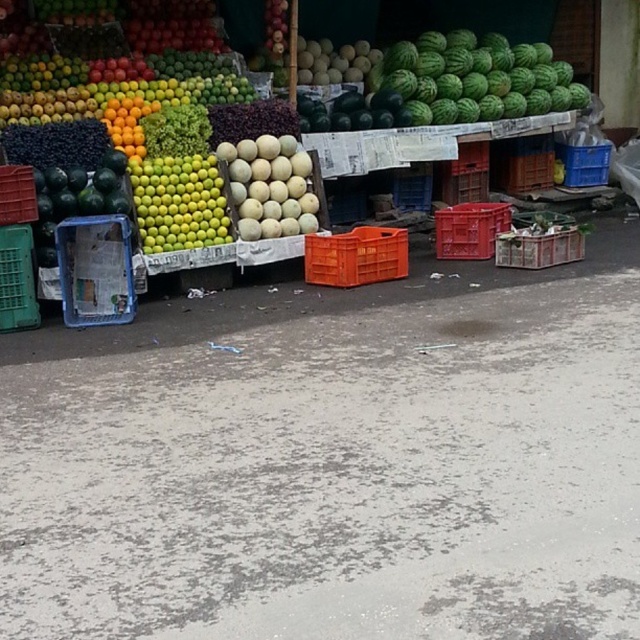
Is green plastic crate at left thinner than matte plastic crate at left?

Incorrect, green plastic crate at left's width is not less than matte plastic crate at left's.

Looking at this image, who is lower down, green plastic crate at left or matte plastic crate at left?

Positioned lower is green plastic crate at left.

Measure the distance between green plastic crate at left and camera.

They are 6.27 meters apart.

Image resolution: width=640 pixels, height=640 pixels. Find the location of `green plastic crate at left`. green plastic crate at left is located at coordinates (17, 280).

Measure the distance from green matte melon at center to wooden crate at center.

The distance of green matte melon at center from wooden crate at center is 2.88 meters.

Is green matte melon at center wider than wooden crate at center?

No.

Who is more distant from viewer, [161,236] or [556,227]?

The point [556,227] is more distant.

You are a GUI agent. You are given a task and a screenshot of the screen. Output one action in this format:
    pyautogui.click(x=<x>, y=<y>)
    Task: Click on the green matte melon at center
    This screenshot has height=640, width=640.
    Given the screenshot: What is the action you would take?
    pyautogui.click(x=179, y=204)

Is green matte melon at center below brown woven basket at center-right?

Correct, green matte melon at center is located below brown woven basket at center-right.

Between point (205, 236) and point (547, 164), which one is positioned in front?

Point (205, 236) is in front.

Locate an element on the screen. The image size is (640, 640). green matte melon at center is located at coordinates coord(179,204).